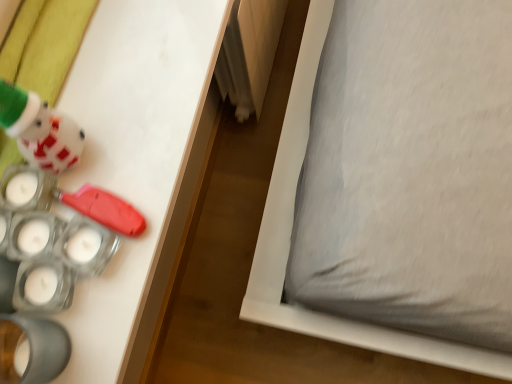
Question: Looking at their shapes, would you say matte white plush at upper left, which is the first toy in top-to-bottom order, is wider or thinner than translucent plastic candle holder at lower left, which is the second toy from top to bottom?

Choices:
 (A) wide
 (B) thin

Answer: (A)

Question: Would you say matte white plush at upper left, which is the first toy in top-to-bottom order, is to the left or to the right of translucent plastic candle holder at lower left, which is counted as the first toy, starting from the bottom, in the picture?

Choices:
 (A) right
 (B) left

Answer: (B)

Question: Which object is the farthest from the translucent plastic candle holder at lower left, which is counted as the first toy, starting from the bottom?

Choices:
 (A) matte white plush at upper left, which is the first toy in top-to-bottom order
 (B) gray fabric pillow at lower right

Answer: (B)

Question: Estimate the real-world distances between objects in this image. Which object is closer to the gray fabric pillow at lower right?

Choices:
 (A) matte white plush at upper left, placed as the second toy when sorted from bottom to top
 (B) translucent plastic candle holder at lower left, which is the second toy from top to bottom

Answer: (A)